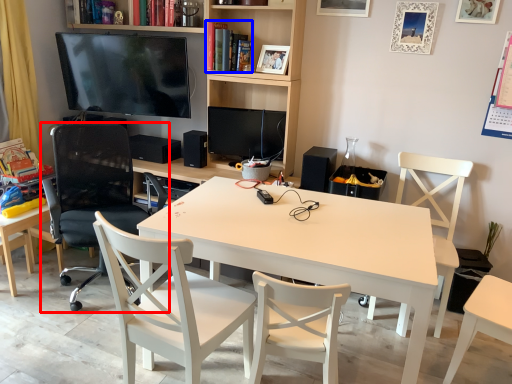
Question: Among these objects, which one is farthest to the camera, chair (highlighted by a red box) or book (highlighted by a blue box)?

Choices:
 (A) chair
 (B) book

Answer: (B)